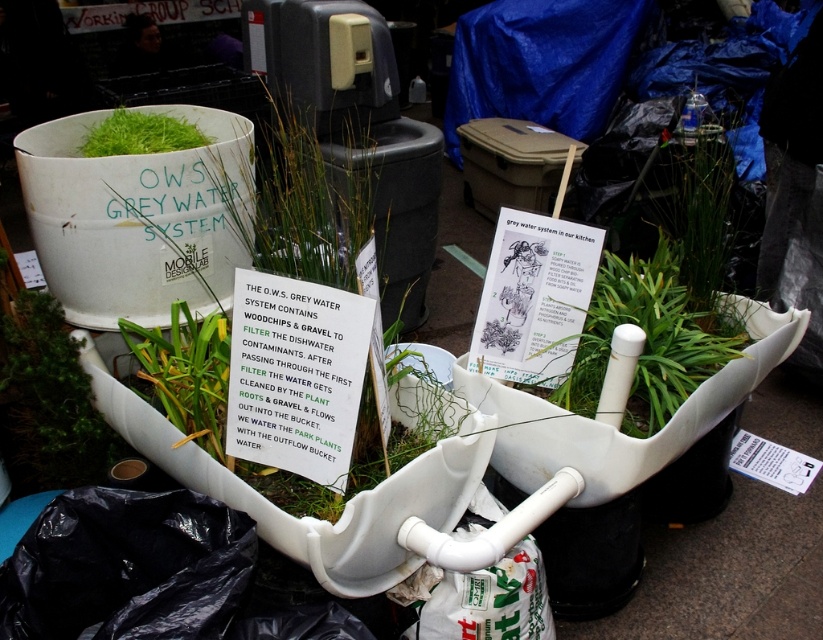
Is green grassy plant at center positioned before green grass at upper left?

No, green grassy plant at center is behind green grass at upper left.

Can you confirm if green grassy plant at center is positioned below green grass at upper left?

Yes.

Find the location of a particular element. The image size is (823, 640). green grassy plant at center is located at coordinates (691, 202).

Is green matte plant at lower left behind green grassy plant at center?

No, it is not.

Is green matte plant at lower left taller than green grassy plant at center?

In fact, green matte plant at lower left may be shorter than green grassy plant at center.

Between point (45, 401) and point (715, 196), which one is positioned in front?

Point (45, 401) is more forward.

At what (x,y) coordinates should I click in order to perform the action: click on green matte plant at lower left. Please return your answer as a coordinate pair (x, y). Looking at the image, I should click on (50, 403).

Can you confirm if green matte plant at lower left is positioned to the right of green grass at upper left?

Incorrect, green matte plant at lower left is not on the right side of green grass at upper left.

Who is more forward, (3,340) or (122,113)?

Positioned in front is point (3,340).

The height and width of the screenshot is (640, 823). I want to click on green matte plant at lower left, so click(x=50, y=403).